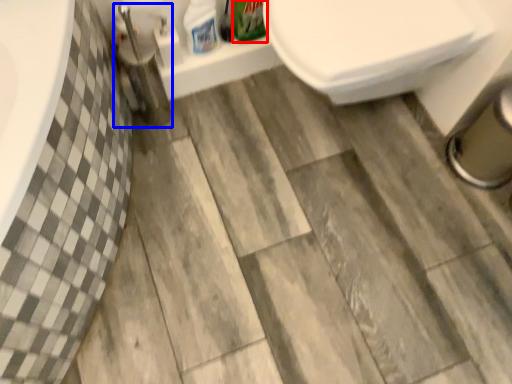
Question: Which object is further to the camera taking this photo, cleaning product (highlighted by a red box) or plumbing fixture (highlighted by a blue box)?

Choices:
 (A) cleaning product
 (B) plumbing fixture

Answer: (A)